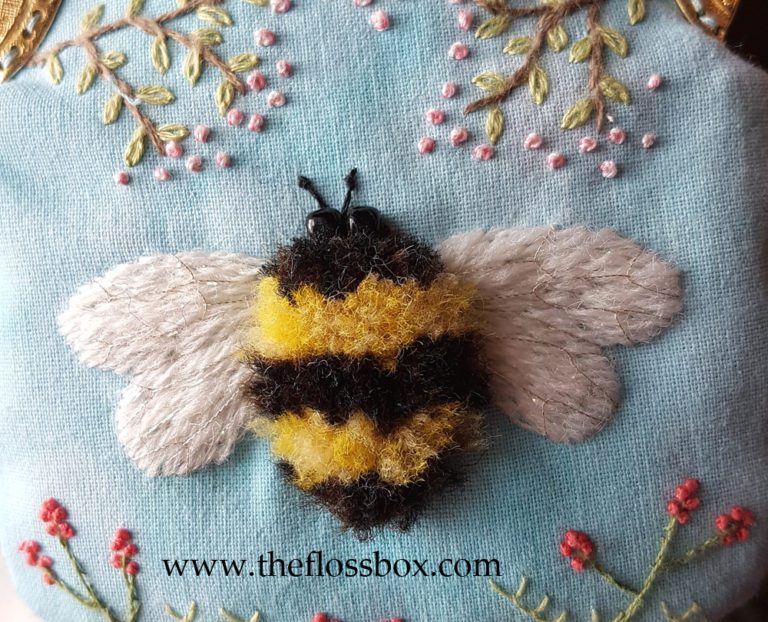
Where is `left corner of embroidery`? This screenshot has height=622, width=768. left corner of embroidery is located at coordinates (20, 30).